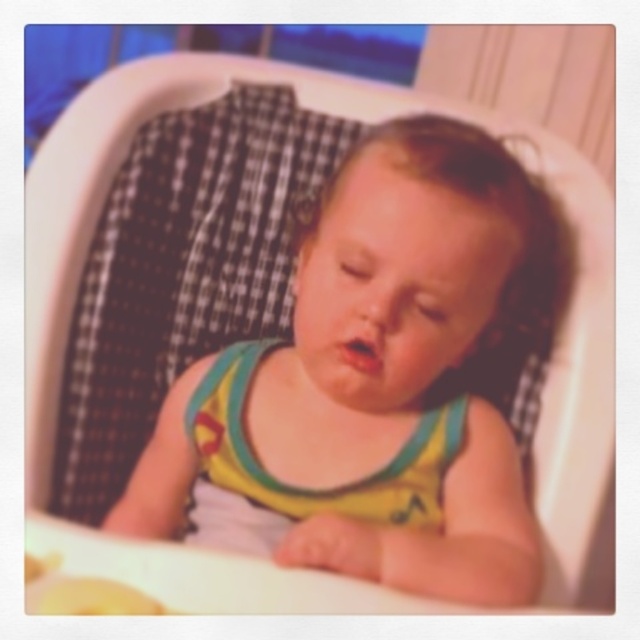
Question: Can you confirm if yellow-green fabric toddler at center is positioned to the left of yellow fabric bib at center?

Choices:
 (A) no
 (B) yes

Answer: (A)

Question: Among these objects, which one is farthest from the camera?

Choices:
 (A) yellow-green fabric toddler at center
 (B) yellow fabric bib at center

Answer: (B)

Question: Observing the image, what is the correct spatial positioning of yellow-green fabric toddler at center in reference to yellow fabric bib at center?

Choices:
 (A) above
 (B) below

Answer: (A)

Question: Does yellow-green fabric toddler at center come in front of yellow fabric bib at center?

Choices:
 (A) no
 (B) yes

Answer: (B)